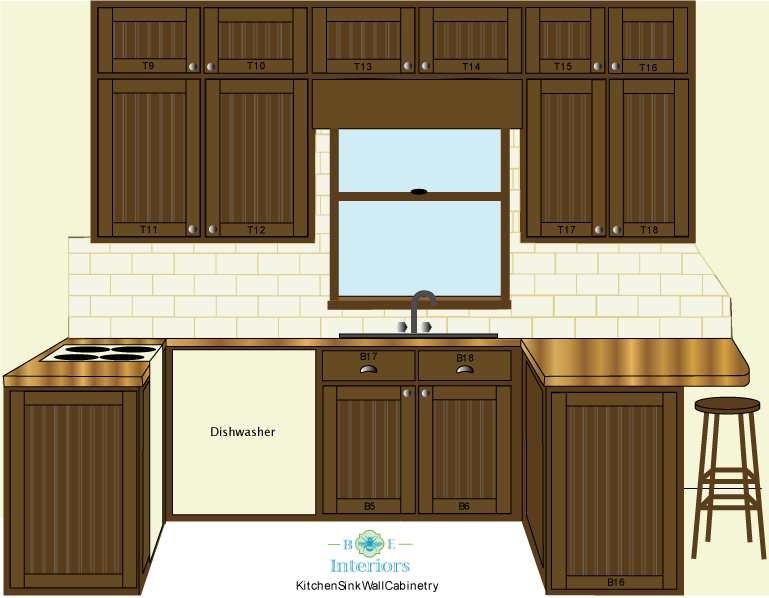
Where is `floor`? The image size is (769, 598). floor is located at coordinates (261, 570).